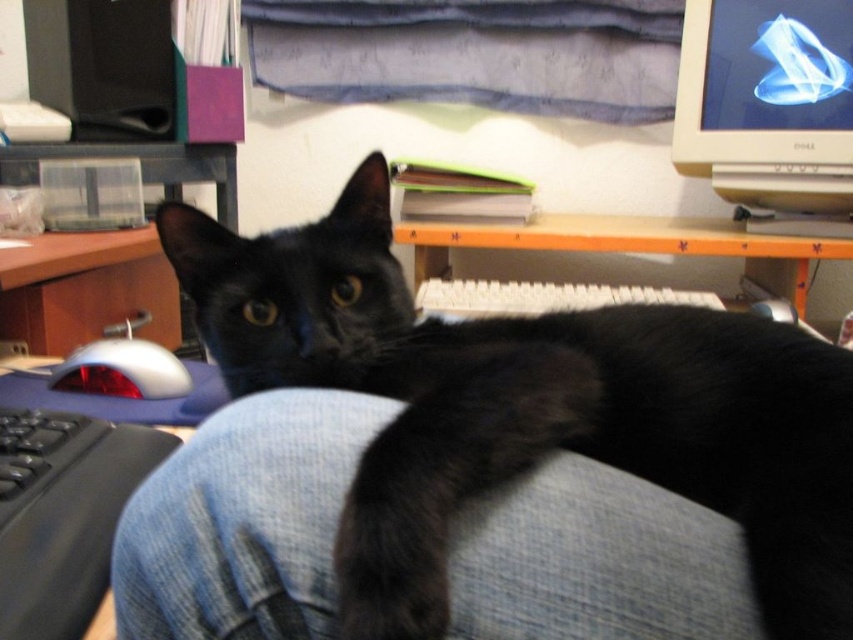
Does matte silver monitor at upper right have a lesser width compared to black plastic keyboard at lower left?

No, matte silver monitor at upper right is not thinner than black plastic keyboard at lower left.

Is matte silver monitor at upper right to the right of black plastic keyboard at lower left from the viewer's perspective?

Correct, you'll find matte silver monitor at upper right to the right of black plastic keyboard at lower left.

This screenshot has height=640, width=853. What are the coordinates of `matte silver monitor at upper right` in the screenshot? It's located at (769, 109).

Consider the image. Does black fur cat at center appear under white plastic keyboard at center?

Indeed, black fur cat at center is positioned under white plastic keyboard at center.

Is the position of black fur cat at center more distant than that of white plastic keyboard at center?

That is False.

Describe the element at coordinates (527, 406) in the screenshot. I see `black fur cat at center` at that location.

Where is `black fur cat at center`? The width and height of the screenshot is (853, 640). black fur cat at center is located at coordinates (527, 406).

Who is more distant from viewer, (567, 538) or (753, 186)?

Point (753, 186)

Is black fur tail at lower center wider than matte silver monitor at upper right?

No, black fur tail at lower center is not wider than matte silver monitor at upper right.

Who is more distant from viewer, [142,621] or [761,116]?

The point [761,116] is more distant.

This screenshot has height=640, width=853. I want to click on black fur tail at lower center, so click(x=242, y=522).